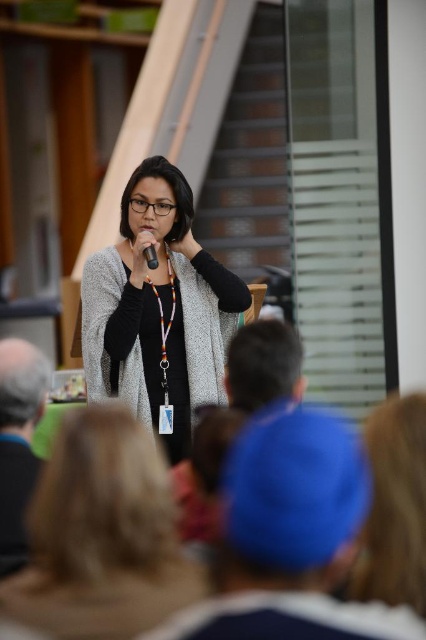
Between point (34, 376) and point (149, 252), which one is positioned in front?

Positioned in front is point (34, 376).

Which is below, gray fabric cap at lower left or black plastic microphone at center?

gray fabric cap at lower left is below.

Identify the location of gray fabric cap at lower left. (19, 442).

The image size is (426, 640). What do you see at coordinates (291, 538) in the screenshot?
I see `blue knit cap at lower center` at bounding box center [291, 538].

Find the location of a particular element. blue knit cap at lower center is located at coordinates (291, 538).

The width and height of the screenshot is (426, 640). What are the coordinates of `blue knit cap at lower center` in the screenshot? It's located at coord(291,538).

Does blonde hair at lower left have a larger size compared to gray fabric cap at lower left?

Indeed, blonde hair at lower left has a larger size compared to gray fabric cap at lower left.

Can you confirm if blonde hair at lower left is thinner than gray fabric cap at lower left?

Incorrect, blonde hair at lower left's width is not less than gray fabric cap at lower left's.

Is point (46, 461) positioned after point (13, 528)?

Yes, point (46, 461) is farther from viewer.

Where is `blonde hair at lower left`? This screenshot has width=426, height=640. blonde hair at lower left is located at coordinates (101, 536).